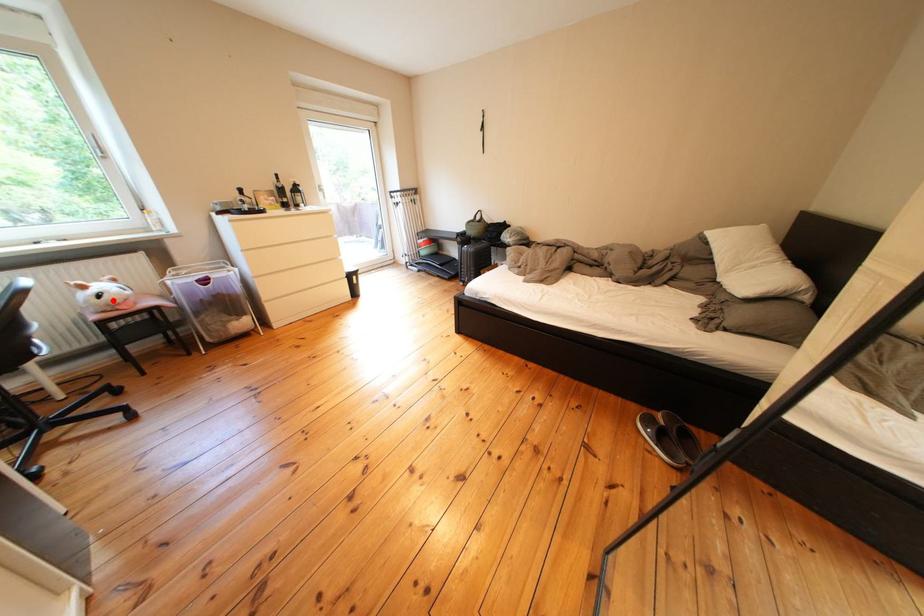
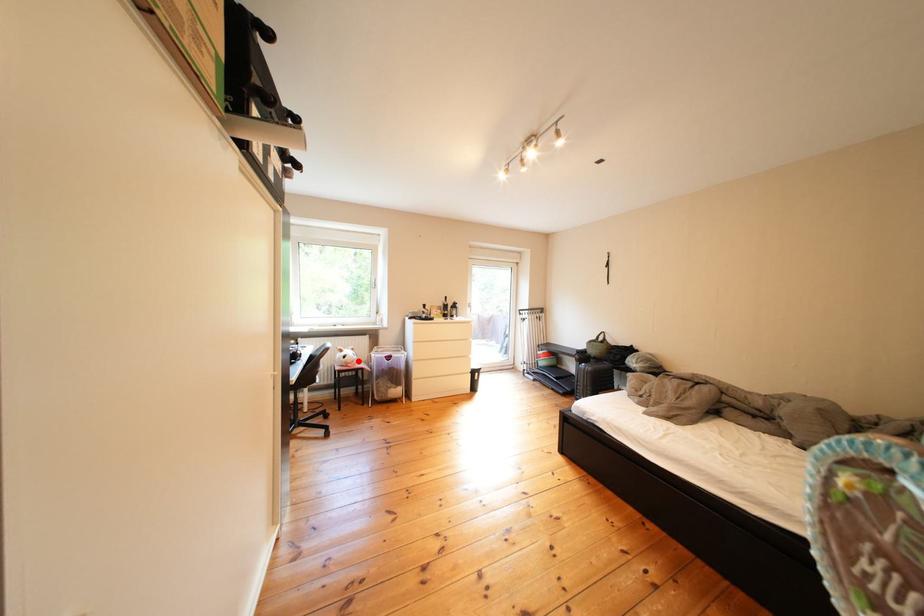
I am providing you with two images of the same scene from different viewpoints. A red point is marked on the first image and another point is marked on the second image. Is the marked point in image1 the same physical position as the marked point in image2?

Yes